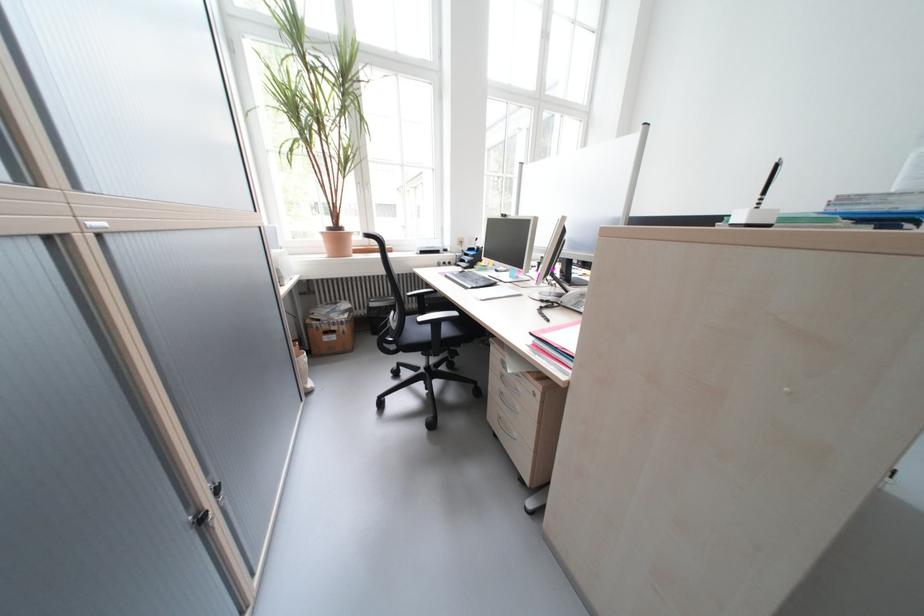
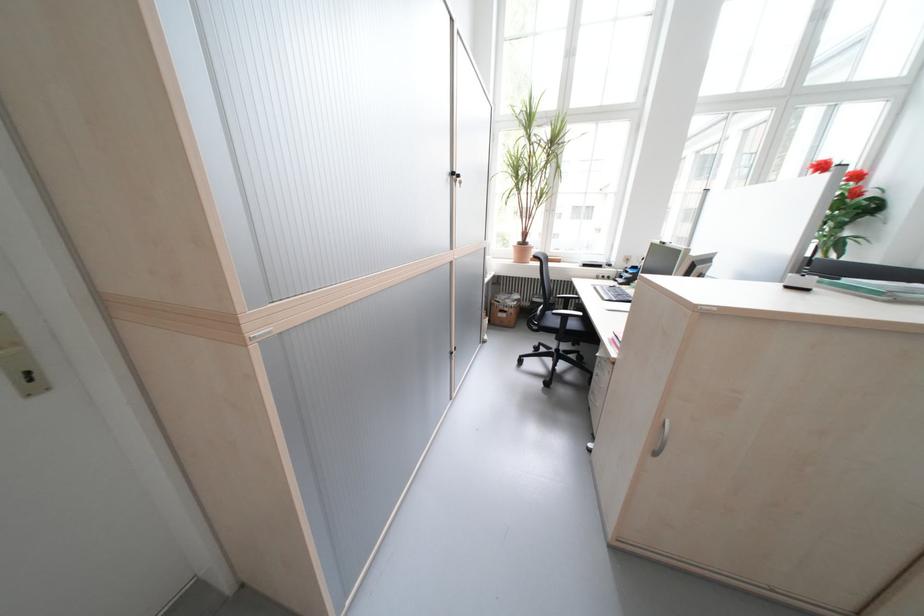
The point at (344, 339) is marked in the first image. Where is the corresponding point in the second image?

(515, 315)